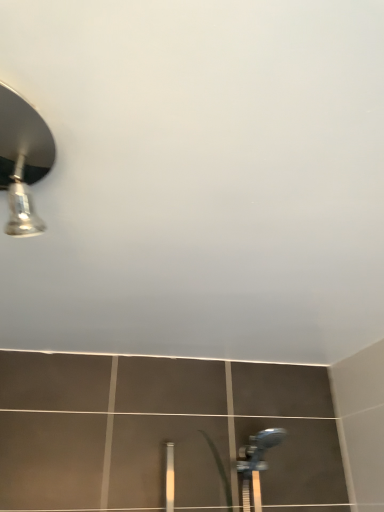
Locate an element on the screen. polished chrome shower head at upper left is located at coordinates (22, 159).

Measure the distance between polished chrome shower head at upper left and camera.

They are 56.72 centimeters apart.

Measure the distance between point (3,175) and camera.

Point (3,175) and camera are 26.61 inches apart.

Describe the element at coordinates (22, 159) in the screenshot. Image resolution: width=384 pixels, height=512 pixels. I see `polished chrome shower head at upper left` at that location.

The height and width of the screenshot is (512, 384). Find the location of `polished chrome shower head at upper left`. polished chrome shower head at upper left is located at coordinates (22, 159).